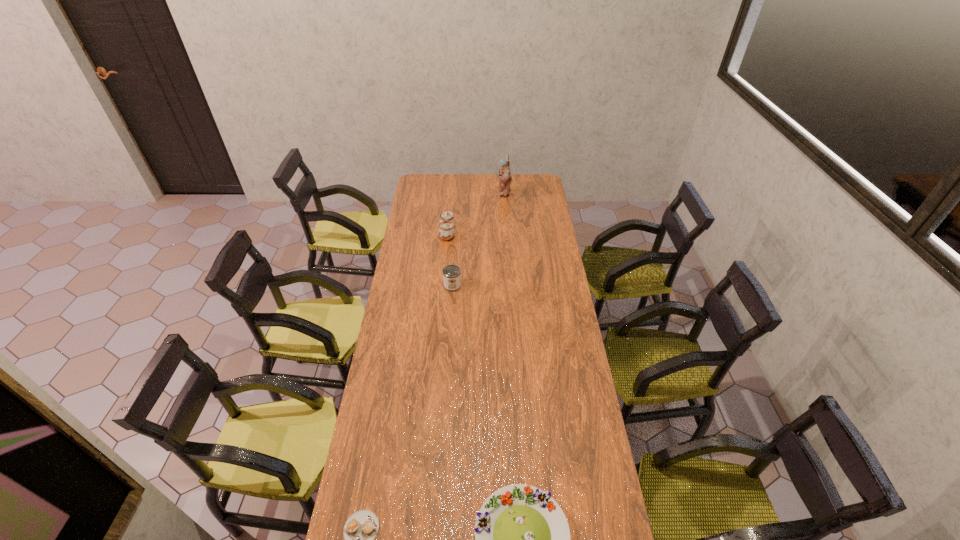
Select which object appears as the closest to the tallest object. Please provide its 2D coordinates. Your answer should be formatted as a tuple, i.e. [(x, y)], where the tuple contains the x and y coordinates of a point satisfying the conditions above.

[(446, 231)]

This screenshot has height=540, width=960. What are the coordinates of `free region that satisfies the following two spatial constraints: 1. by the handle of the third farthest object; 2. on the right side of the chinaware` in the screenshot? It's located at (443, 286).

Find the location of a particular element. free space that satisfies the following two spatial constraints: 1. by the handle of the can; 2. on the right side of the chinaware is located at coordinates (443, 286).

The width and height of the screenshot is (960, 540). I want to click on free space that satisfies the following two spatial constraints: 1. by the handle of the chinaware; 2. on the back side of the third shortest object, so click(443, 286).